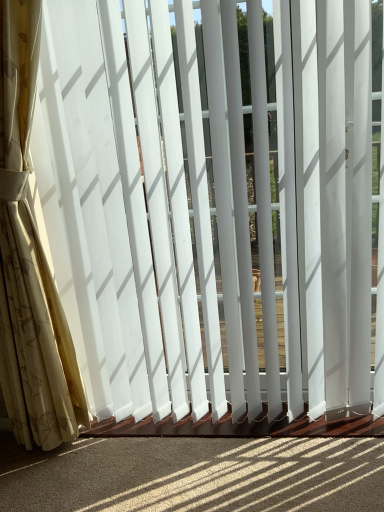
I want to click on free space below white sheer curtain at left (from a real-world perspective), so click(x=84, y=443).